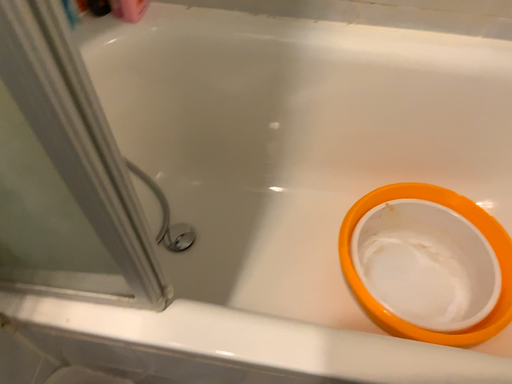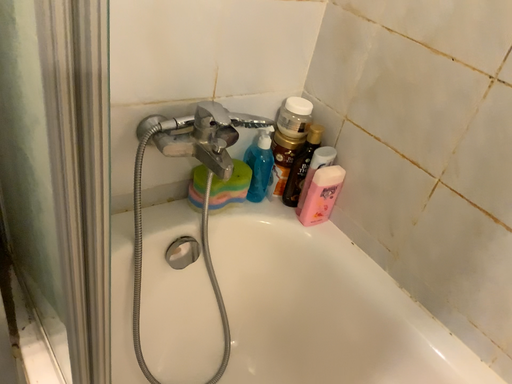
Question: Which way did the camera rotate in the video?

Choices:
 (A) rotated upward
 (B) rotated downward

Answer: (A)